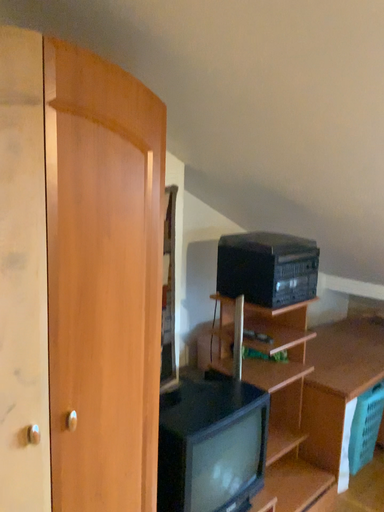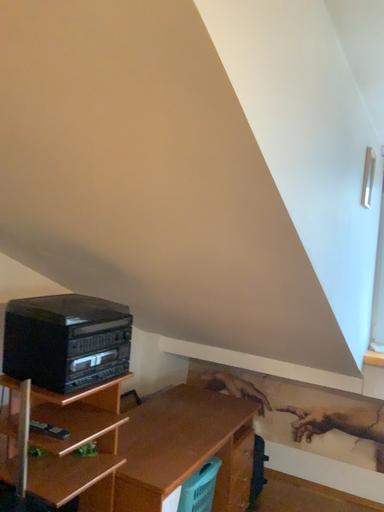
Question: How did the camera likely rotate when shooting the video?

Choices:
 (A) rotated right
 (B) rotated left

Answer: (A)